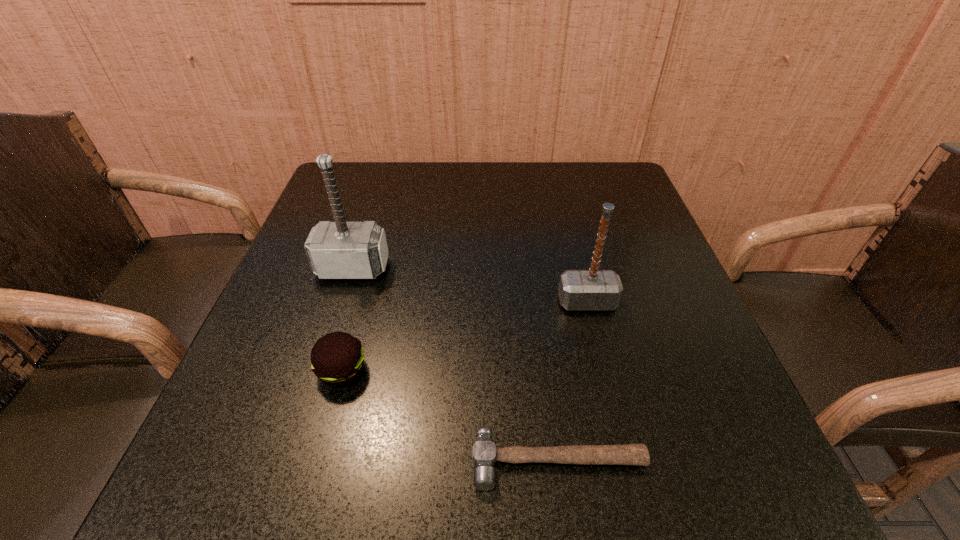
Identify the location of free space between the second farthest hammer and the nearest object. The image size is (960, 540). (573, 382).

Find the location of `free space that is in between the patty and the nearest hammer`. free space that is in between the patty and the nearest hammer is located at coordinates (450, 416).

Select which object appears as the third closest to the nearest hammer. Please provide its 2D coordinates. Your answer should be formatted as a tuple, i.e. [(x, y)], where the tuple contains the x and y coordinates of a point satisfying the conditions above.

[(336, 250)]

The height and width of the screenshot is (540, 960). What are the coordinates of `object that is the third nearest to the second shortest object` in the screenshot? It's located at (593, 289).

Locate which hammer ranks third in proximity to the third tallest object. Please provide its 2D coordinates. Your answer should be formatted as a tuple, i.e. [(x, y)], where the tuple contains the x and y coordinates of a point satisfying the conditions above.

[(593, 289)]

The width and height of the screenshot is (960, 540). Find the location of `the third closest hammer to the second nearest object`. the third closest hammer to the second nearest object is located at coordinates (593, 289).

You are a GUI agent. You are given a task and a screenshot of the screen. Output one action in this format:
    pyautogui.click(x=<x>, y=<y>)
    Task: Click on the vacant space that satisfies the following two spatial constraints: 1. for striking with the head of the second nearest object; 2. on the left side of the farthest hammer
    The height and width of the screenshot is (540, 960).
    Given the screenshot: What is the action you would take?
    pyautogui.click(x=321, y=370)

The height and width of the screenshot is (540, 960). I want to click on free region that satisfies the following two spatial constraints: 1. for striking with the head of the second nearest object; 2. on the right side of the farthest object, so click(321, 370).

Locate an element on the screen. Image resolution: width=960 pixels, height=540 pixels. free region that satisfies the following two spatial constraints: 1. for striking with the head of the leftmost hammer; 2. on the left side of the third tallest object is located at coordinates (321, 370).